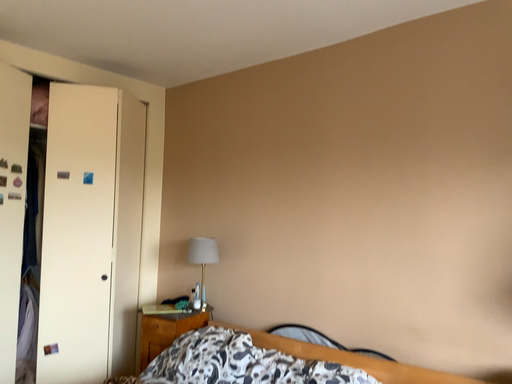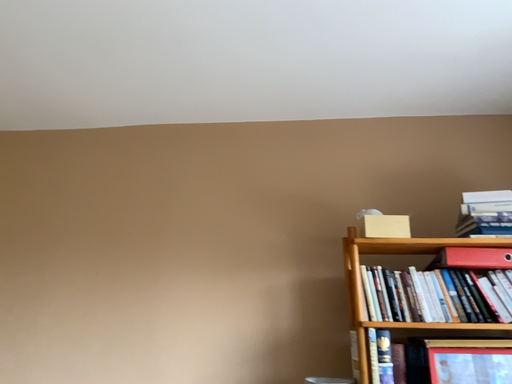
Question: Which way did the camera rotate in the video?

Choices:
 (A) rotated downward
 (B) rotated upward

Answer: (B)